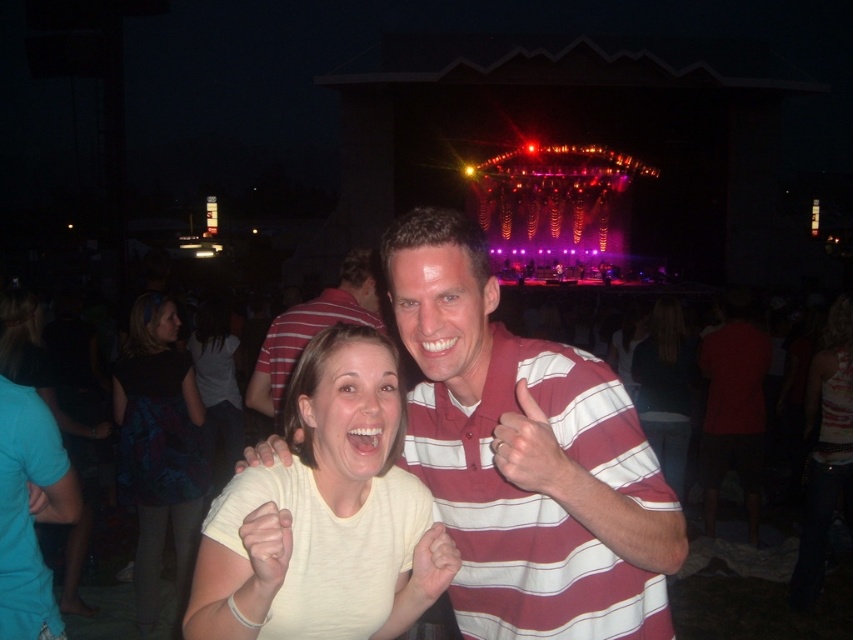
Consider the image. Who is more forward, [572,568] or [637,344]?

Point [572,568]

Between white striped polo shirt at center and white cotton shirt at center, which one appears on the left side from the viewer's perspective?

From the viewer's perspective, white striped polo shirt at center appears more on the left side.

Locate an element on the screen. The image size is (853, 640). white striped polo shirt at center is located at coordinates (503, 477).

Can you confirm if white matte t-shirt at center is smaller than smooth red shirt at center?

Actually, white matte t-shirt at center might be larger than smooth red shirt at center.

Can you confirm if white matte t-shirt at center is positioned above smooth red shirt at center?

No, white matte t-shirt at center is not above smooth red shirt at center.

Is point (390, 596) positioned before point (544, 440)?

No, it is behind (544, 440).

You are a GUI agent. You are given a task and a screenshot of the screen. Output one action in this format:
    pyautogui.click(x=<x>, y=<y>)
    Task: Click on the white matte t-shirt at center
    The width and height of the screenshot is (853, 640).
    Given the screenshot: What is the action you would take?
    click(325, 515)

Is white matte t-shirt at center shorter than white cotton shirt at center?

No.

Where is `white matte t-shirt at center`? Image resolution: width=853 pixels, height=640 pixels. white matte t-shirt at center is located at coordinates (325, 515).

Locate an element on the screen. The image size is (853, 640). white matte t-shirt at center is located at coordinates (325, 515).